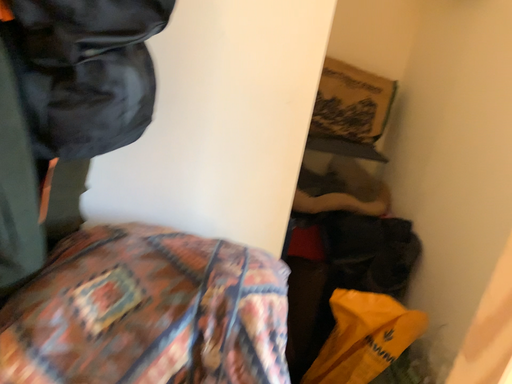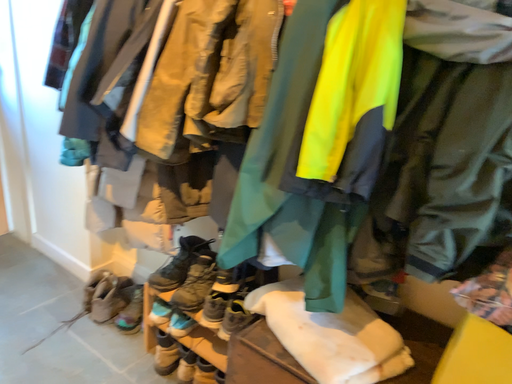
Question: Which way did the camera rotate in the video?

Choices:
 (A) rotated upward
 (B) rotated downward

Answer: (A)